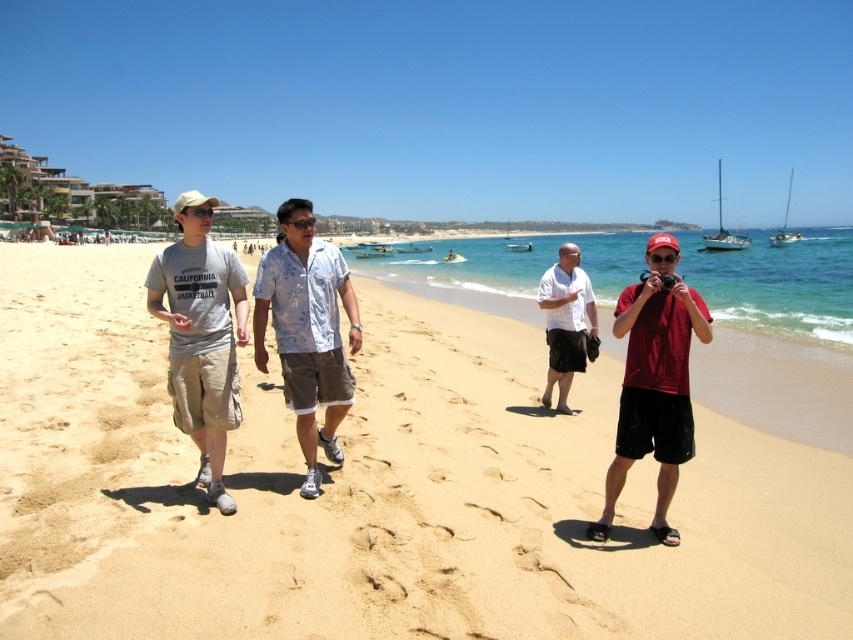
Question: Which of the following is the closest to the observer?

Choices:
 (A) matte red shirt at center
 (B) floral fabric shirt at center
 (C) beige sand at center
 (D) gray cotton t-shirt at left

Answer: (C)

Question: Does floral fabric shirt at center lie behind white cotton shirt at center?

Choices:
 (A) no
 (B) yes

Answer: (A)

Question: Among these points, which one is farthest from the camera?

Choices:
 (A) (654, 442)
 (B) (86, 483)

Answer: (B)

Question: Which point is closer to the camera taking this photo?

Choices:
 (A) (569, 339)
 (B) (299, 410)
 (C) (662, 461)
 (D) (224, 314)

Answer: (C)

Question: Does gray cotton t-shirt at left appear under white cotton shirt at center?

Choices:
 (A) no
 (B) yes

Answer: (A)

Question: Can you confirm if matte red shirt at center is thinner than white cotton shirt at center?

Choices:
 (A) yes
 (B) no

Answer: (B)